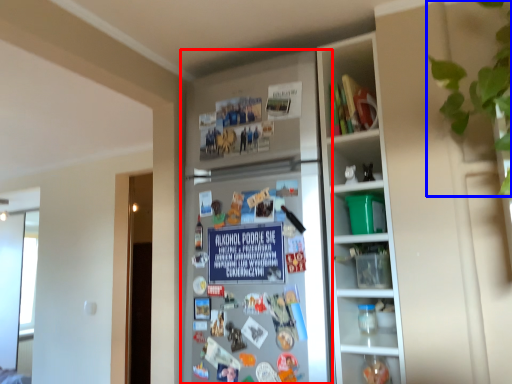
Question: Which of the following is the farthest to the observer, fridge (highlighted by a red box) or plant (highlighted by a blue box)?

Choices:
 (A) fridge
 (B) plant

Answer: (A)